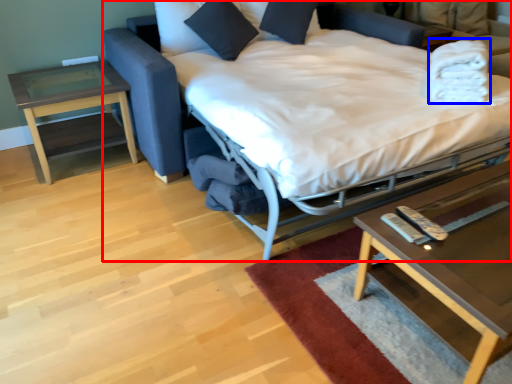
Question: Which object is closer to the camera taking this photo, bed (highlighted by a red box) or blanket (highlighted by a blue box)?

Choices:
 (A) bed
 (B) blanket

Answer: (A)